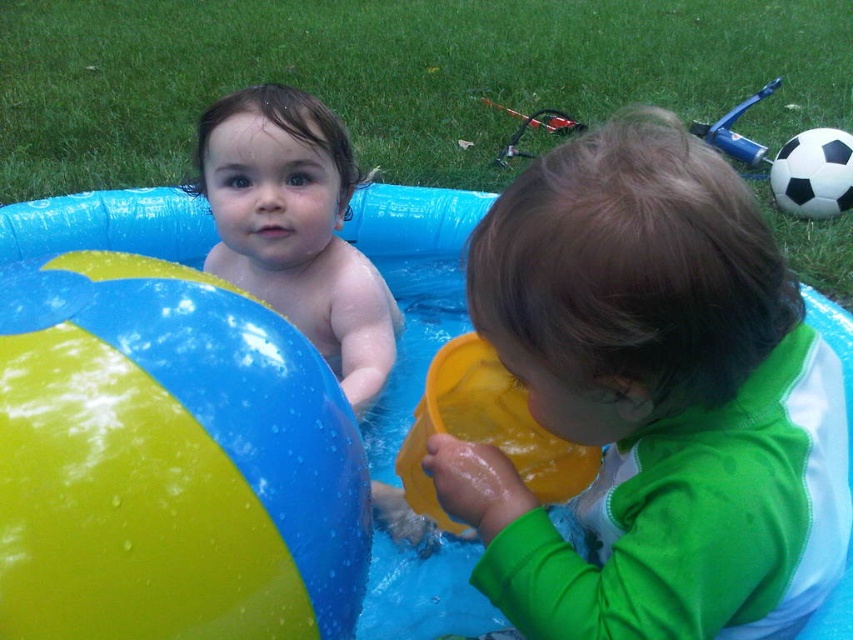
Who is higher up, blue rubber pool at center or smooth skin baby at center?

smooth skin baby at center is above.

What do you see at coordinates (416, 280) in the screenshot? Image resolution: width=853 pixels, height=640 pixels. I see `blue rubber pool at center` at bounding box center [416, 280].

Who is more forward, [22,204] or [207,189]?

Point [207,189] is more forward.

What are the coordinates of `blue rubber pool at center` in the screenshot? It's located at (416, 280).

Between point (344, 605) and point (810, 193), which one is positioned behind?

The point (810, 193) is behind.

Identify the location of yellowmattebeach ball at left. The image size is (853, 640). (169, 461).

Who is lower down, blue rubber pool at center or black matte soccer ball at upper right?

blue rubber pool at center

Can you confirm if blue rubber pool at center is taller than black matte soccer ball at upper right?

Yes, blue rubber pool at center is taller than black matte soccer ball at upper right.

Where is `blue rubber pool at center`? This screenshot has height=640, width=853. blue rubber pool at center is located at coordinates point(416,280).

Where is `blue rubber pool at center`? Image resolution: width=853 pixels, height=640 pixels. blue rubber pool at center is located at coordinates (416, 280).